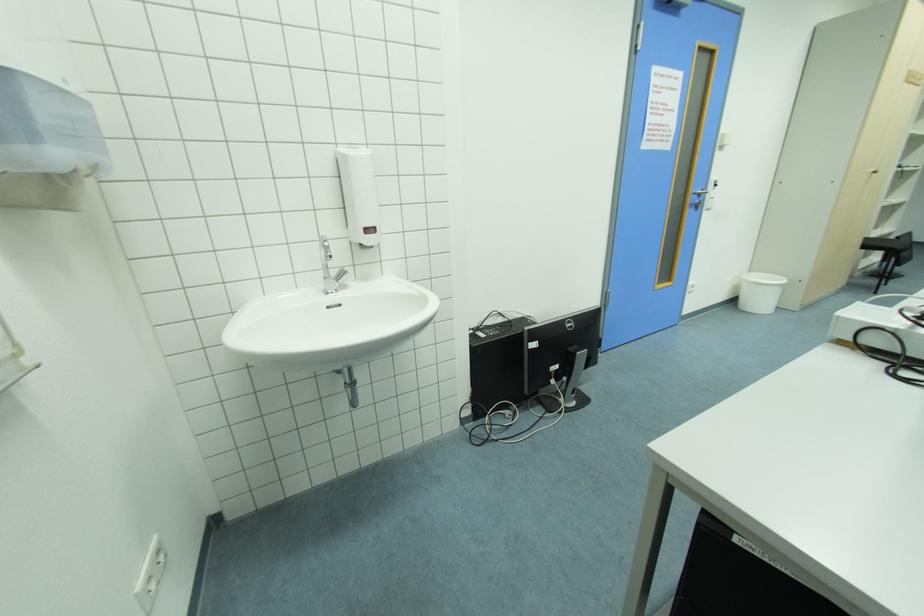
In order to click on metal door handle in this screenshot , I will do `click(703, 195)`.